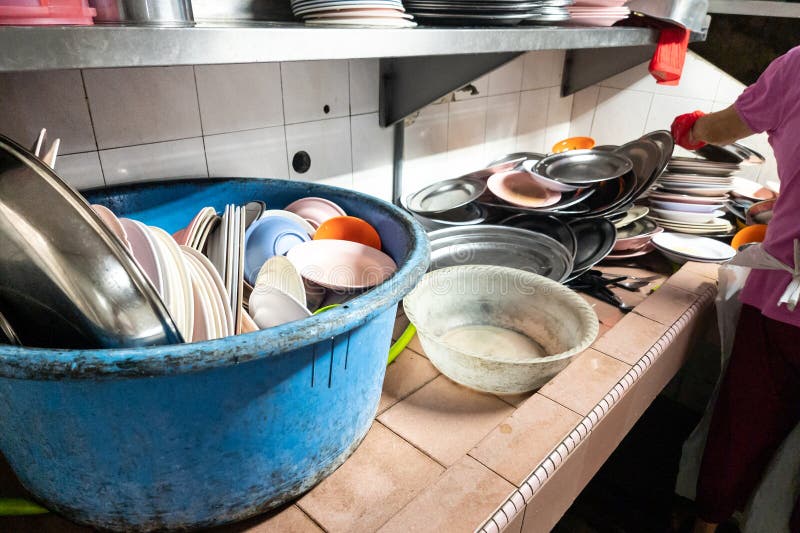
At what (x,y) coordinates should I click in order to perform the action: click on white plastic bowl. Please return your answer as a coordinate pair (x, y). This screenshot has height=533, width=800. Looking at the image, I should click on (486, 331).